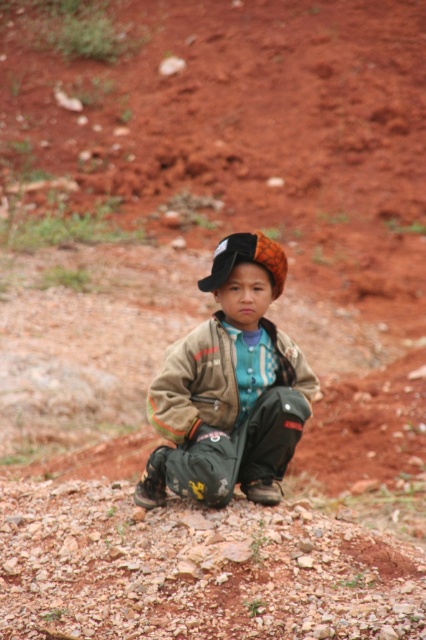
Who is positioned more to the left, camouflage pants at center or orange patterned hat at center?

camouflage pants at center

Where is `camouflage pants at center`? camouflage pants at center is located at coordinates (230, 387).

Does camouflage pants at center appear on the left side of brown textured jacket at center?

In fact, camouflage pants at center is to the right of brown textured jacket at center.

Describe the element at coordinates (230, 387) in the screenshot. This screenshot has width=426, height=640. I see `camouflage pants at center` at that location.

This screenshot has height=640, width=426. I want to click on camouflage pants at center, so click(230, 387).

At what (x,y) coordinates should I click in order to perform the action: click on camouflage pants at center. Please return your answer as a coordinate pair (x, y). The width and height of the screenshot is (426, 640). Looking at the image, I should click on (230, 387).

Is brown textured jacket at center thinner than orange patterned hat at center?

No.

Describe the element at coordinates (195, 384) in the screenshot. I see `brown textured jacket at center` at that location.

Which is in front, point (198, 328) or point (261, 244)?

Point (261, 244) is in front.

Find the location of a particular element. brown textured jacket at center is located at coordinates 195,384.